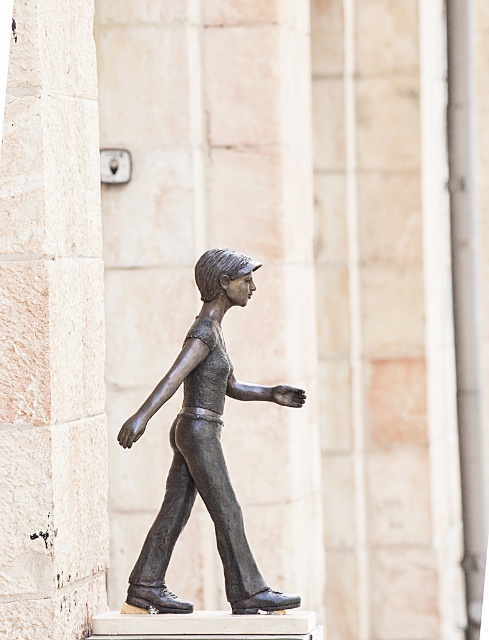
The height and width of the screenshot is (640, 489). In order to click on beige stone pillar at center in this screenshot , I will do `click(51, 328)`.

Is point (23, 268) closer to viewer compared to point (249, 577)?

Yes, point (23, 268) is closer to viewer.

Locate an element on the screen. The height and width of the screenshot is (640, 489). beige stone pillar at center is located at coordinates (51, 328).